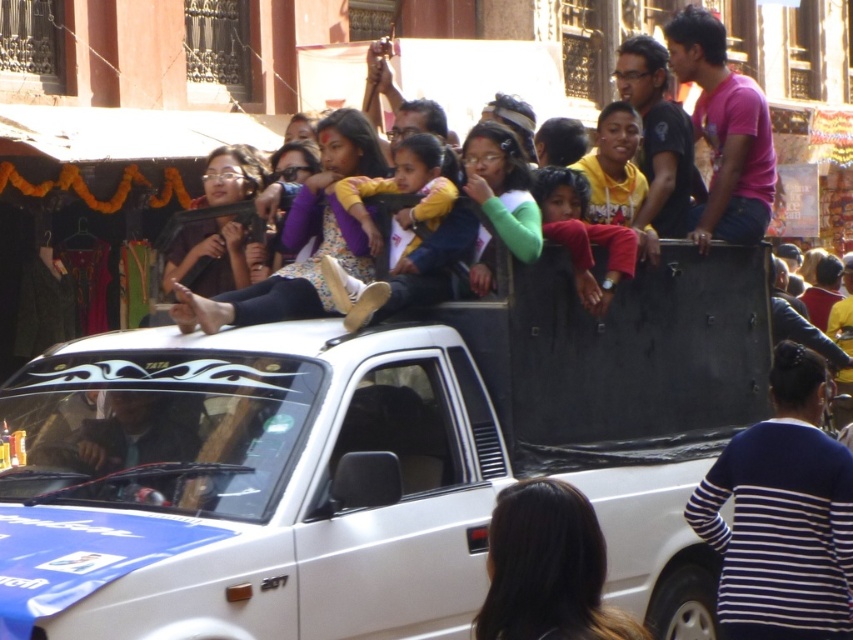
You are a photographer trying to capture a closeup of the pink matte shirt at upper right and the yellow fabric jacket at center. Since you want to focus on both, which one do you need to adjust your camera settings to accommodate for its larger size?

The pink matte shirt at upper right has a greater width than the yellow fabric jacket at center, so you should adjust your camera settings to accommodate the pink matte shirt at upper right.

You are a safety inspector checking the vehicle for compliance. The safety regulations state that all passengers must be at least 10 feet away from each other for safety. Are the yellow fabric jacket at center and red fabric child at center violating the safety regulations?

The yellow fabric jacket at center is 7.39 feet from the red fabric child at center, which is less than the required 10 feet. Therefore, they are violating the safety regulations.

You are a photographer standing near the camera. You want to take a photo of the yellow fabric jacket at center. Is the jacket within your camera lens range? The camera can capture objects up to 25 meters away.

The yellow fabric jacket at center and camera are 24.73 meters apart, so yes, the jacket is within the camera lens range since it is within the 25 meters limit.